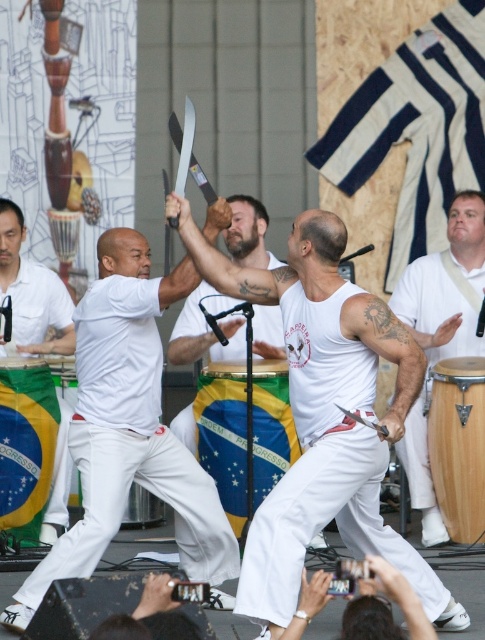
Question: Does white matte/soft shirt at center appear under white smooth t-shirt at center?

Choices:
 (A) yes
 (B) no

Answer: (A)

Question: Does white matte tank top at center appear on the left side of white cotton pants at left?

Choices:
 (A) no
 (B) yes

Answer: (A)

Question: Which point is closer to the camera taking this photo?

Choices:
 (A) (455, 272)
 (B) (25, 472)
 (C) (10, 250)

Answer: (B)

Question: In this image, where is white smooth t-shirt at center located relative to wooden drum at center-right?

Choices:
 (A) left
 (B) right

Answer: (A)

Question: Which point is farther from the camera taking this photo?

Choices:
 (A) (267, 410)
 (B) (20, 600)
 (C) (39, 461)
 (D) (449, 529)

Answer: (D)

Question: Based on their relative distances, which object is farther from the green and yellow fabric drum at lower left?

Choices:
 (A) white matte/soft shirt at center
 (B) wooden drum at center-right
 (C) white cotton pants at left

Answer: (B)